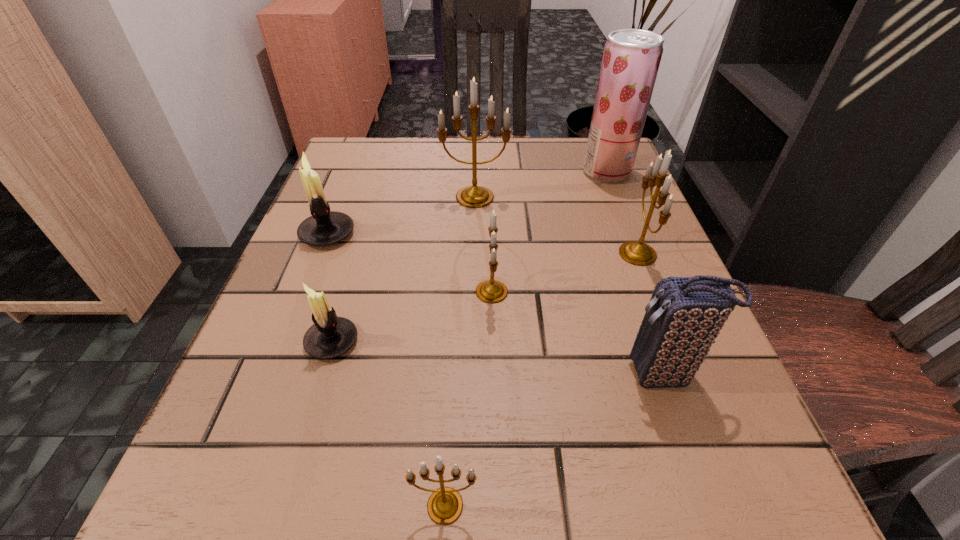
The image size is (960, 540). I want to click on free region at the far edge, so click(413, 153).

What are the coordinates of `free space at the left edge of the desktop` in the screenshot? It's located at (232, 377).

Find the location of a particular element. The image size is (960, 540). vacant region at the right edge of the desktop is located at coordinates (739, 418).

Locate an element on the screen. vacant region at the far left corner of the desktop is located at coordinates (344, 180).

I want to click on vacant space at the far right corner of the desktop, so click(572, 166).

Identify the location of vacant space at the near right corner of the desktop. (653, 474).

Where is `free space between the farthest object and the clutch bag`? The width and height of the screenshot is (960, 540). free space between the farthest object and the clutch bag is located at coordinates (636, 273).

The height and width of the screenshot is (540, 960). Find the location of `free point between the nearest candelabrum and the second smallest gold candelabrum`. free point between the nearest candelabrum and the second smallest gold candelabrum is located at coordinates (468, 399).

The image size is (960, 540). What are the coordinates of `free space that is in between the second smallest gold candelabrum and the bigger white candle holder` in the screenshot? It's located at (410, 262).

Image resolution: width=960 pixels, height=540 pixels. Find the location of `free space between the bigger white candle holder and the tallest candelabrum`. free space between the bigger white candle holder and the tallest candelabrum is located at coordinates (401, 215).